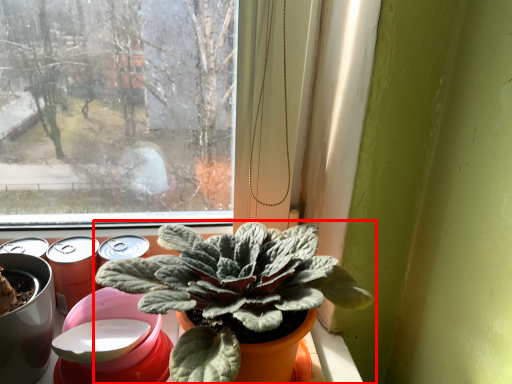
Question: Observing the image, what is the correct spatial positioning of houseplant (annotated by the red box) in reference to beer?

Choices:
 (A) left
 (B) right

Answer: (B)